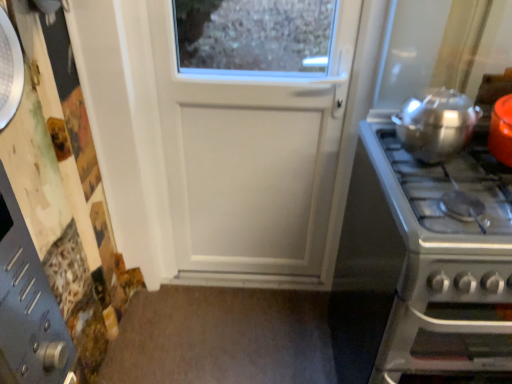
Locate an element on the screen. Image resolution: width=512 pixels, height=384 pixels. satin silver gas stove at right is located at coordinates (446, 263).

Image resolution: width=512 pixels, height=384 pixels. What do you see at coordinates (446, 263) in the screenshot? I see `satin silver gas stove at right` at bounding box center [446, 263].

This screenshot has width=512, height=384. What do you see at coordinates (436, 124) in the screenshot?
I see `shiny metallic pot at right` at bounding box center [436, 124].

Find the location of a particular element. This screenshot has height=384, width=512. shiny metallic pot at right is located at coordinates (436, 124).

Where is `satin silver gas stove at right`? The image size is (512, 384). satin silver gas stove at right is located at coordinates (446, 263).

Based on their positions, is shiny metallic pot at right located to the left or right of satin silver gas stove at right?

shiny metallic pot at right is positioned on satin silver gas stove at right's left side.

Is shiny metallic pot at right positioned before satin silver gas stove at right?

No.

Considering the positions of points (474, 116) and (493, 237), is point (474, 116) farther from camera compared to point (493, 237)?

Yes, point (474, 116) is behind point (493, 237).

From the image's perspective, is shiny metallic pot at right beneath satin silver gas stove at right?

Incorrect, from the image's perspective, shiny metallic pot at right is higher than satin silver gas stove at right.

From a real-world perspective, which is physically below, shiny metallic pot at right or satin silver gas stove at right?

From a 3D spatial view, satin silver gas stove at right is below.

Consider the image. Which of these two, shiny metallic pot at right or satin silver gas stove at right, is thinner?

shiny metallic pot at right is thinner.

Between shiny metallic pot at right and satin silver gas stove at right, which one has more height?

Standing taller between the two is satin silver gas stove at right.

Who is smaller, shiny metallic pot at right or satin silver gas stove at right?

With smaller size is shiny metallic pot at right.

Can we say shiny metallic pot at right lies outside satin silver gas stove at right?

Yes.

Would you consider shiny metallic pot at right to be distant from satin silver gas stove at right?

No, shiny metallic pot at right is not far away from satin silver gas stove at right.

From the picture: Is shiny metallic pot at right looking in the opposite direction of satin silver gas stove at right?

That's not correct — shiny metallic pot at right is not looking away from satin silver gas stove at right.

Find the location of `kitchen appliance behind the satin silver gas stove at right`. kitchen appliance behind the satin silver gas stove at right is located at coordinates (436, 124).

From the picture: Visually, is satin silver gas stove at right positioned to the left or to the right of shiny metallic pot at right?

Based on their positions, satin silver gas stove at right is located to the right of shiny metallic pot at right.

Which object is closer to the camera taking this photo, satin silver gas stove at right or shiny metallic pot at right?

satin silver gas stove at right.

Which is less distant, (371, 141) or (406, 101)?

Point (371, 141).

From the image's perspective, would you say satin silver gas stove at right is positioned over shiny metallic pot at right?

No, from the image's perspective, satin silver gas stove at right is not over shiny metallic pot at right.

From a real-world perspective, does satin silver gas stove at right stand above shiny metallic pot at right?

Actually, satin silver gas stove at right is physically below shiny metallic pot at right in the real world.

Is satin silver gas stove at right wider than shiny metallic pot at right?

Correct, the width of satin silver gas stove at right exceeds that of shiny metallic pot at right.

Consider the image. Which of these two, satin silver gas stove at right or shiny metallic pot at right, stands taller?

satin silver gas stove at right is taller.

In terms of size, does satin silver gas stove at right appear bigger or smaller than shiny metallic pot at right?

In the image, satin silver gas stove at right appears to be larger than shiny metallic pot at right.

Is satin silver gas stove at right completely or partially outside of shiny metallic pot at right?

Yes, satin silver gas stove at right is outside of shiny metallic pot at right.

Is satin silver gas stove at right positioned far away from shiny metallic pot at right?

satin silver gas stove at right is actually quite close to shiny metallic pot at right.

Could you tell me if satin silver gas stove at right is facing shiny metallic pot at right?

No, satin silver gas stove at right is not facing towards shiny metallic pot at right.

How different are the orientations of satin silver gas stove at right and shiny metallic pot at right in degrees?

They differ by 0.233 degrees in their facing directions.

Measure the distance from satin silver gas stove at right to shiny metallic pot at right.

22.42 centimeters.

Locate an element on the screen. This screenshot has width=512, height=384. gas stove in front of the shiny metallic pot at right is located at coordinates (446, 263).

Identify the location of gas stove that is below the shiny metallic pot at right (from the image's perspective). (446, 263).

This screenshot has height=384, width=512. I want to click on kitchen appliance above the satin silver gas stove at right (from the image's perspective), so click(x=436, y=124).